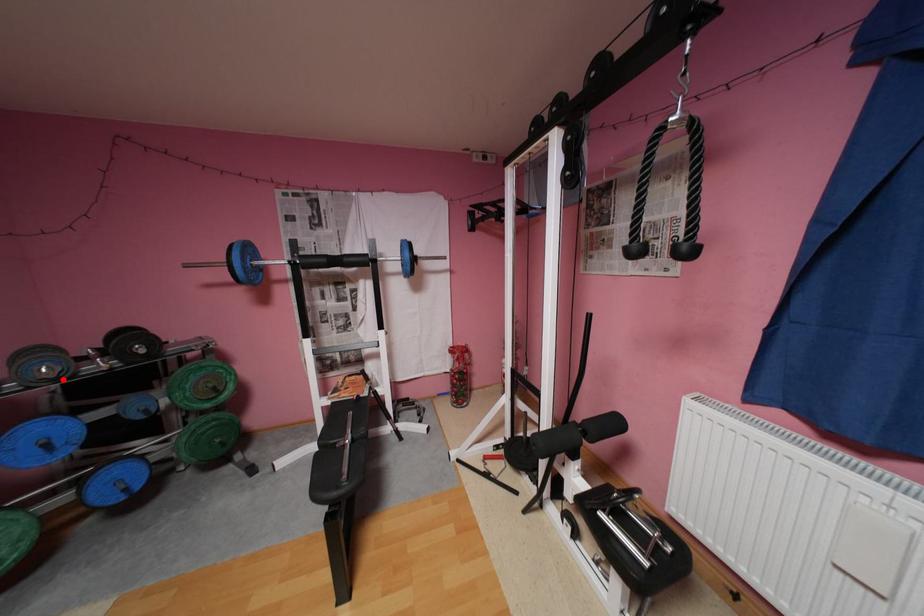
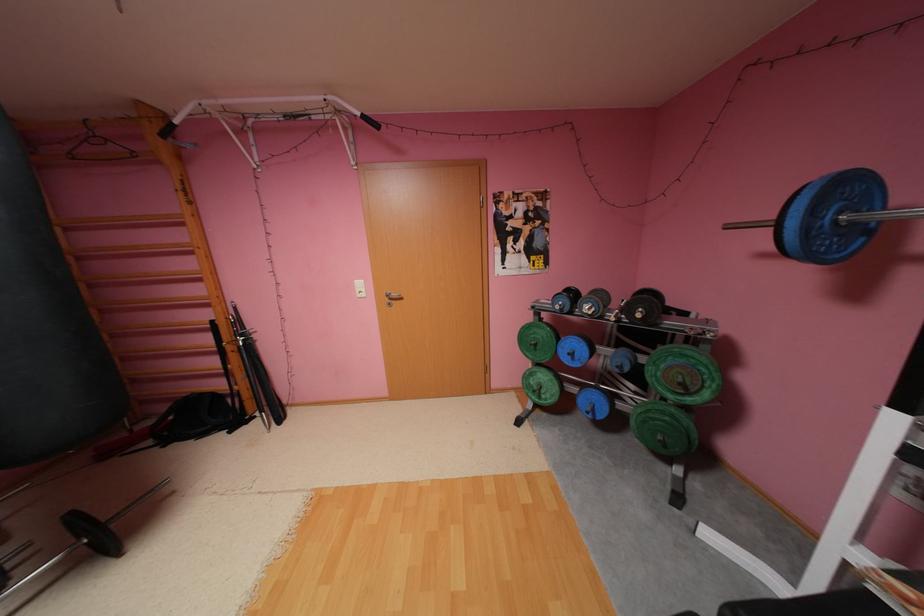
Locate, in the second image, the point that corresponds to the highlighted location in the first image.

(600, 315)